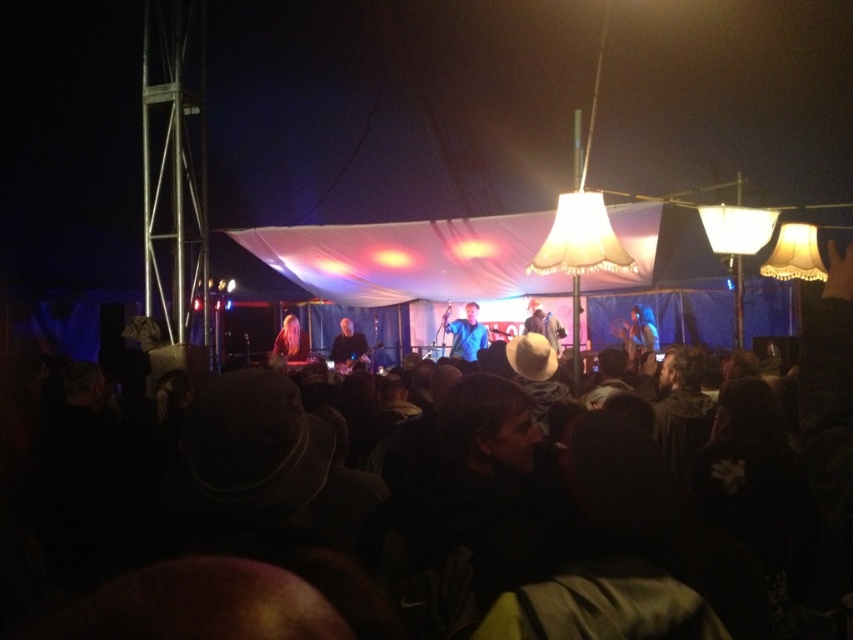
You are a photographer at the concert. You want to take a photo focusing on the smooth black guitar at center and the blonde hair at center. Which object will appear larger in the photo?

The smooth black guitar at center will appear larger in the photo because it is closer to the viewer than the blonde hair at center.

You are a photographer at the concert and want to capture the blue fabric at center and the smooth black guitar at center in the same frame. Based on their positions, which object should you focus on first to ensure both are in the frame?

The blue fabric at center is to the right of the smooth black guitar at center, so you should focus on the smooth black guitar at center first to ensure both are in the frame.

You are a photographer at the concert and want to capture both the blue fabric at center and the smooth black guitar at center in a single shot. Which object will appear larger in your photo?

The blue fabric at center will appear larger in the photo because it is closer to the viewer than the smooth black guitar at center.